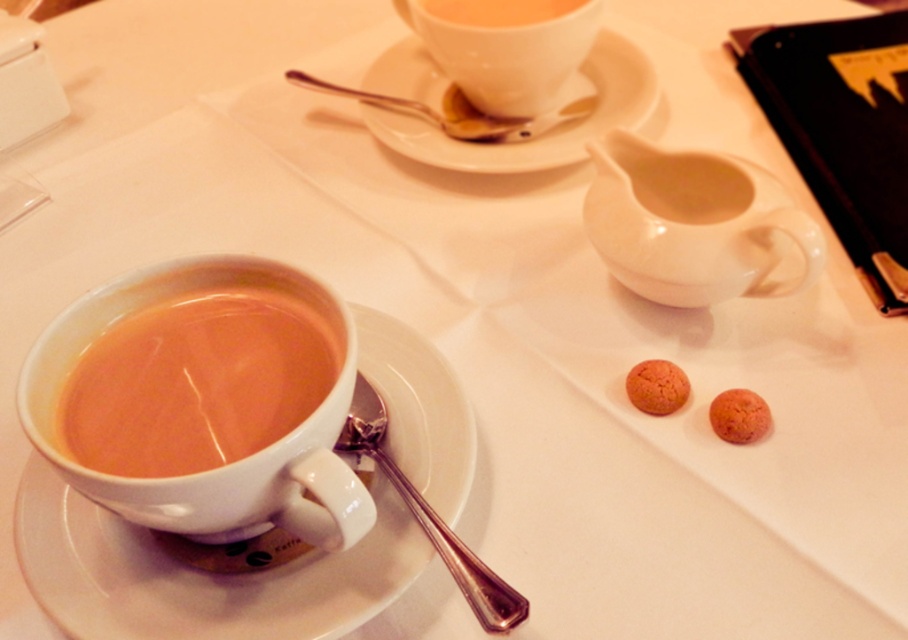
You are a barista preparing drinks and need to place both the white glossy creamer at upper right and the white ceramic saucer at upper center on a shelf. The shelf has a height limit of 10 cm. Can both items fit vertically on the shelf without exceeding the height limit?

The white glossy creamer at upper right is shorter than the white ceramic saucer at upper center. Since the shelf has a height limit of 10 cm, both items can fit vertically as long as the tallest item, the white ceramic saucer at upper center, is under 10 cm in height.

You are a barista preparing drinks and need to pour milk into the matte ceramic cup at upper center. The white glossy creamer at upper right is available. Can the milk from the creamer fit into the cup without spilling?

The white glossy creamer at upper right has a larger width than the matte ceramic cup at upper center. Since the creamer is wider, pouring its contents into the cup might cause the milk to spill over, especially if the cup is already filled with liquid. It is advisable to use a narrower container or pour carefully to avoid overflow.